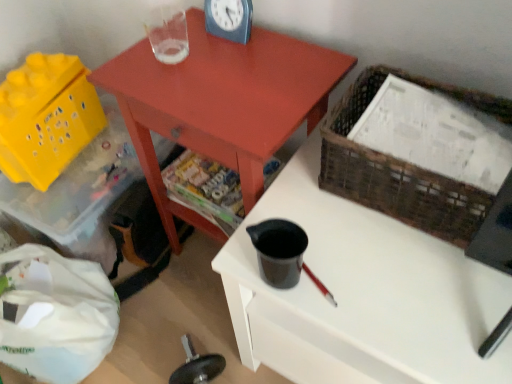
Question: Is point (371, 203) positioned closer to the camera than point (53, 185)?

Choices:
 (A) farther
 (B) closer

Answer: (B)

Question: Choose the correct answer: Is woven brown basket at upper right, the first basket viewed from the front, inside yellow plastic storage box at lower left or outside it?

Choices:
 (A) outside
 (B) inside

Answer: (A)

Question: Which of these objects is positioned farthest from the woven brown basket at upper right, the 2th basket from the back?

Choices:
 (A) matte red table at center
 (B) black plastic cup at center
 (C) blue plastic clock at upper center
 (D) yellow plastic basket at lower left, the second basket positioned from the front
 (E) yellow plastic storage box at lower left

Answer: (D)

Question: Estimate the real-world distances between objects in this image. Which object is closer to the yellow plastic basket at lower left, placed as the first basket when sorted from back to front?

Choices:
 (A) black plastic cup at center
 (B) yellow plastic storage box at lower left
 (C) matte red table at center
 (D) blue plastic clock at upper center
 (E) woven brown basket at upper right, the 2th basket from the back

Answer: (B)